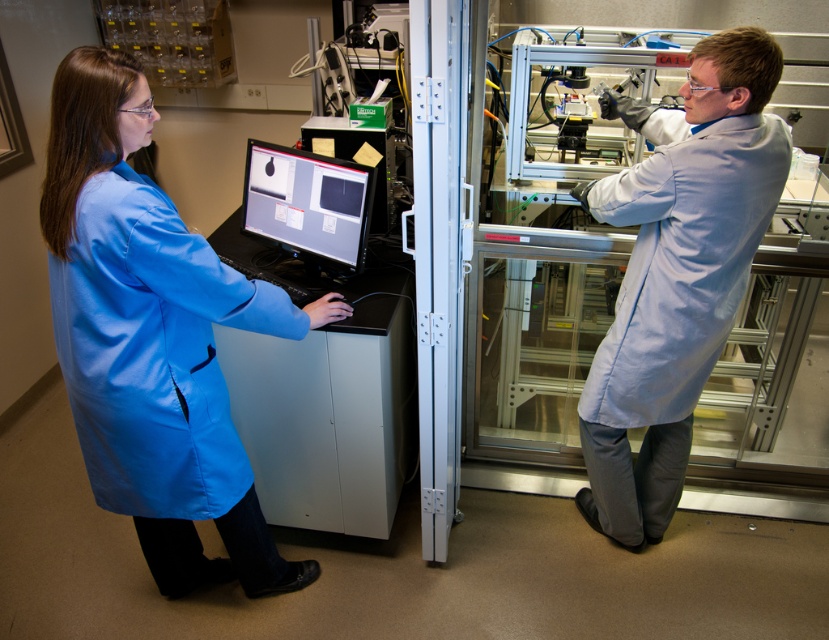
Question: Is the position of blue matte lab coat at center less distant than that of matte black monitor at center?

Choices:
 (A) yes
 (B) no

Answer: (A)

Question: Which point is closer to the camera?

Choices:
 (A) (298, 150)
 (B) (117, 493)

Answer: (B)

Question: Which object is the closest to the light blue lab coat at right?

Choices:
 (A) blue matte lab coat at center
 (B) matte black monitor at center

Answer: (B)

Question: Does light blue lab coat at right lie in front of matte black monitor at center?

Choices:
 (A) no
 (B) yes

Answer: (B)

Question: Is blue matte lab coat at center positioned in front of light blue lab coat at right?

Choices:
 (A) yes
 (B) no

Answer: (A)

Question: Which point is farther from the camera taking this photo?

Choices:
 (A) (274, 166)
 (B) (192, 272)
 (C) (697, 172)

Answer: (A)